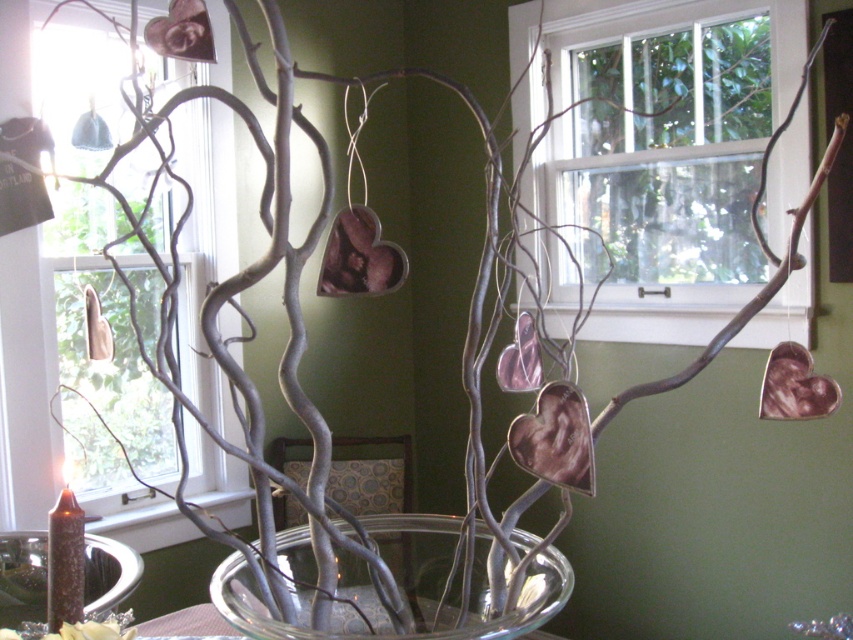
Question: Which point appears farthest from the camera in this image?

Choices:
 (A) (88, 614)
 (B) (485, 568)

Answer: (A)

Question: Which is nearer to the clear glass bowl at center?

Choices:
 (A) clear glass bowl at lower left
 (B) metallic silver flower at lower left

Answer: (B)

Question: Does clear glass bowl at center have a smaller size compared to metallic silver flower at lower left?

Choices:
 (A) no
 (B) yes

Answer: (B)

Question: Where is clear glass bowl at lower left located in relation to metallic silver flower at lower left in the image?

Choices:
 (A) left
 (B) right

Answer: (A)

Question: Considering the real-world distances, which object is farthest from the clear glass bowl at center?

Choices:
 (A) metallic silver flower at lower left
 (B) clear glass bowl at lower left

Answer: (B)

Question: Can you confirm if clear glass bowl at center is positioned below clear glass bowl at lower left?

Choices:
 (A) no
 (B) yes

Answer: (A)